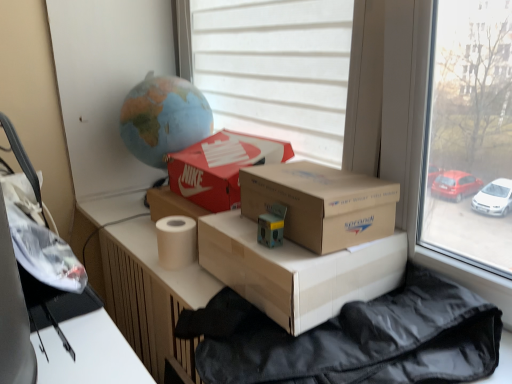
Question: Is matte cardboard box at center, which is the 3th box from top to bottom, aimed at white matte window at center, the second window viewed from the right?

Choices:
 (A) yes
 (B) no

Answer: (B)

Question: Does matte cardboard box at center, which is the 3th box from top to bottom, appear on the left side of white matte window at center, the second window viewed from the right?

Choices:
 (A) no
 (B) yes

Answer: (A)

Question: Considering the relative sizes of matte cardboard box at center, which is the 3th box from top to bottom, and white matte window at center, the second window viewed from the right, in the image provided, is matte cardboard box at center, which is the 3th box from top to bottom, smaller than white matte window at center, the second window viewed from the right,?

Choices:
 (A) no
 (B) yes

Answer: (B)

Question: From a real-world perspective, is matte cardboard box at center, which is the 3th box from top to bottom, located beneath white matte window at center, the second window viewed from the right?

Choices:
 (A) no
 (B) yes

Answer: (B)

Question: Can you confirm if matte cardboard box at center, the 1th box positioned from the bottom, is wider than white matte window at center, the 1th window from the left?

Choices:
 (A) no
 (B) yes

Answer: (B)

Question: Considering their positions, is black synthetic sleeping bag at lower right located in front of or behind matte green plastic toy at center?

Choices:
 (A) behind
 (B) front

Answer: (B)

Question: Based on their positions, is black synthetic sleeping bag at lower right located to the left or right of matte green plastic toy at center?

Choices:
 (A) left
 (B) right

Answer: (B)

Question: Choose the correct answer: Is black synthetic sleeping bag at lower right inside matte green plastic toy at center or outside it?

Choices:
 (A) inside
 (B) outside

Answer: (B)

Question: In terms of height, does black synthetic sleeping bag at lower right look taller or shorter compared to matte green plastic toy at center?

Choices:
 (A) tall
 (B) short

Answer: (A)

Question: Is brown cardboard box at center, the 2th box from the top, situated inside matte green plastic toy at center or outside?

Choices:
 (A) outside
 (B) inside

Answer: (A)

Question: Based on their positions, is brown cardboard box at center, arranged as the 2th box when ordered from the bottom, located to the left or right of matte green plastic toy at center?

Choices:
 (A) left
 (B) right

Answer: (B)

Question: From the image's perspective, is brown cardboard box at center, arranged as the 2th box when ordered from the bottom, located above or below matte green plastic toy at center?

Choices:
 (A) below
 (B) above

Answer: (B)

Question: From their relative heights in the image, would you say brown cardboard box at center, arranged as the 2th box when ordered from the bottom, is taller or shorter than matte green plastic toy at center?

Choices:
 (A) tall
 (B) short

Answer: (A)

Question: Based on their positions, is white matte window at center, the 1th window from the left, located to the left or right of beige matte toilet paper at center?

Choices:
 (A) right
 (B) left

Answer: (A)

Question: Is white matte window at center, the 1th window from the left, wider or thinner than beige matte toilet paper at center?

Choices:
 (A) wide
 (B) thin

Answer: (B)